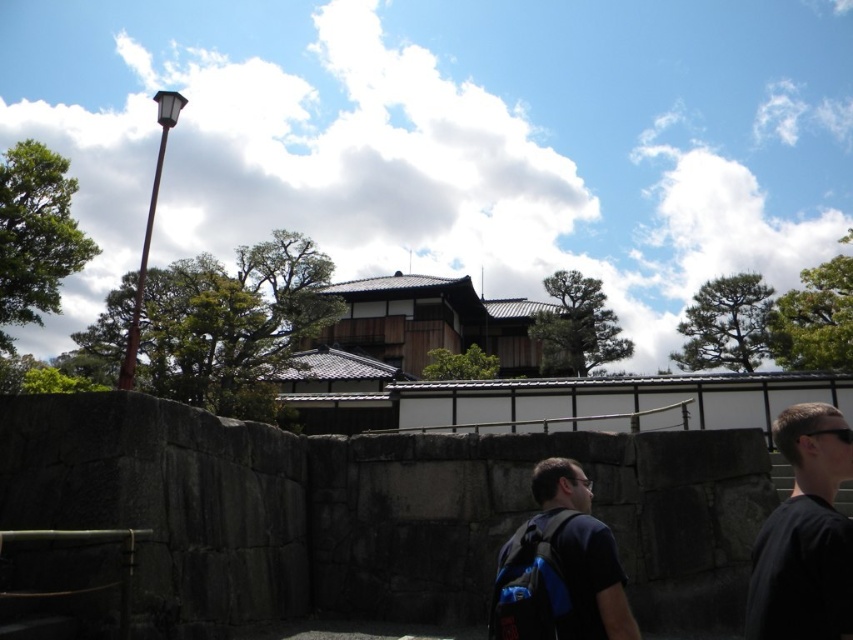
You are standing in a traditional Japanese garden and see the black fabric shirt at right and the brown wooden temple at center. Which object is positioned lower from the ground?

The black fabric shirt at right is positioned lower from the ground than the brown wooden temple at center.

You are a photographer trying to capture the brown wooden temple at center without the dark blue backpack at center blocking the view. Based on the scene, can you position yourself so that the temple is fully visible while the backpack is out of frame?

The dark blue backpack at center occupies less space than the brown wooden temple at center, so yes, you can position yourself to the side or further back to ensure the backpack is out of frame while the temple remains fully visible.

You are a tourist standing in front of the brown wooden temple at center and you see the dark blue backpack at center. Which object is taller?

The brown wooden temple at center is taller than the dark blue backpack at center.